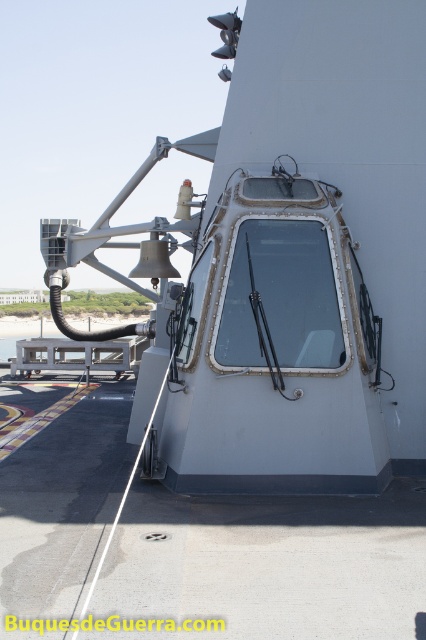
You are a crew member on the naval ship and need to determine the relative positions of two points marked on the deck. Which point is closer to you, point (187, 301) or point (60, 500)?

Result: Point (187, 301) is further to the viewer than point (60, 500), so the closer point to you is point (60, 500).

You are a crew member on the naval ship and need to move from the point at the radar structure to the edge of the deck. The coordinates of the radar structure are point (x=296, y=618) and the edge is at point (x=131, y=356). Which direction should you move to get closer to the edge?

To move from point (x=296, y=618) to the edge at point (x=131, y=356), you should move towards the lower left direction since point (x=296, y=618) is in front of point (x=131, y=356).

You are standing at the point marked as point (356, 528) on the naval ship deck. You want to take a photo of the radar structure with a camera that has a 50mm lens. The camera requires a minimum distance of 5 meters to focus properly. Can you take a clear photo from your current position?

The distance between point (356, 528) and the camera is 4.84 meters, which is less than the required 5 meters for proper focus. Therefore, you cannot take a clear photo from your current position.